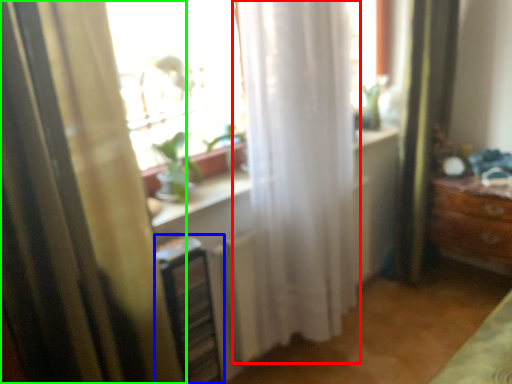
Question: Which object is positioned closest to curtain (highlighted by a red box)? Select from shelf (highlighted by a blue box) and curtain (highlighted by a green box).

Choices:
 (A) shelf
 (B) curtain

Answer: (A)